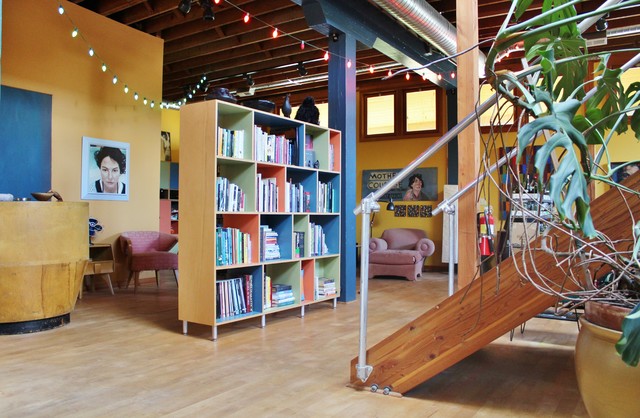
The image size is (640, 418). Identify the location of windows. point(418,110), point(385,111), point(324,114), point(491,98), point(634,76), point(560,78).